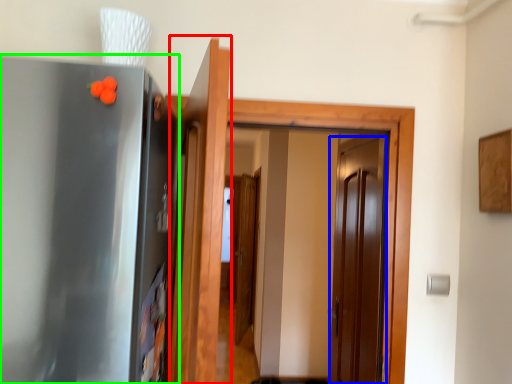
Question: Considering the real-world distances, which object is closest to door (highlighted by a red box)? door (highlighted by a blue box) or appliance (highlighted by a green box).

Choices:
 (A) door
 (B) appliance

Answer: (B)